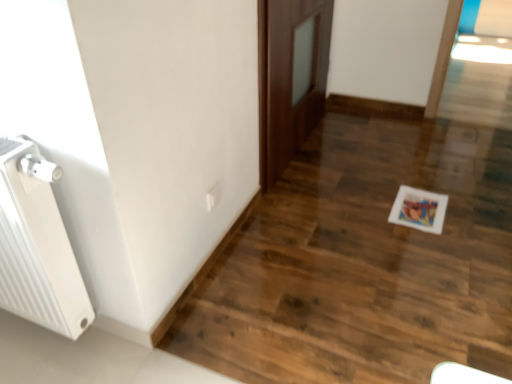
Locate an element on the screen. The height and width of the screenshot is (384, 512). white plastic electric outlet at lower center is located at coordinates (213, 196).

Where is `white plastic electric outlet at lower center`? white plastic electric outlet at lower center is located at coordinates (213, 196).

Considering the sizes of white ribbed radiator at left and brown wooden door at center in the image, is white ribbed radiator at left bigger or smaller than brown wooden door at center?

white ribbed radiator at left is smaller than brown wooden door at center.

Is white ribbed radiator at left inside the boundaries of brown wooden door at center, or outside?

white ribbed radiator at left cannot be found inside brown wooden door at center.

Does point (5, 168) appear closer or farther from the camera than point (308, 51)?

Point (5, 168) is positioned closer to the camera compared to point (308, 51).

How different are the orientations of white ribbed radiator at left and brown wooden door at center in degrees?

The angular difference between white ribbed radiator at left and brown wooden door at center is 89.5 degrees.

Is brown wooden door at center far away from white plastic electric outlet at lower center?

No, brown wooden door at center is not far away from white plastic electric outlet at lower center.

Does brown wooden door at center appear on the right side of white plastic electric outlet at lower center?

Indeed, brown wooden door at center is positioned on the right side of white plastic electric outlet at lower center.

How many degrees apart are the facing directions of brown wooden door at center and white plastic electric outlet at lower center?

0.0669 degrees separate the facing orientations of brown wooden door at center and white plastic electric outlet at lower center.

From the image's perspective, relative to white plastic electric outlet at lower center, is brown wooden door at center above or below?

Based on their image positions, brown wooden door at center is located above white plastic electric outlet at lower center.

Considering the positions of objects white plastic electric outlet at lower center and brown wooden door at center in the image provided, who is in front, white plastic electric outlet at lower center or brown wooden door at center?

white plastic electric outlet at lower center is more forward.

From a real-world perspective, which is physically below, white plastic electric outlet at lower center or brown wooden door at center?

white plastic electric outlet at lower center is physically lower.

Considering the sizes of objects white plastic electric outlet at lower center and brown wooden door at center in the image provided, who is thinner, white plastic electric outlet at lower center or brown wooden door at center?

With smaller width is white plastic electric outlet at lower center.

In the image, is brown wooden door at center positioned in front of or behind white ribbed radiator at left?

Clearly, brown wooden door at center is behind white ribbed radiator at left.

Which of these two, brown wooden door at center or white ribbed radiator at left, is smaller?

With smaller size is white ribbed radiator at left.

Can you confirm if brown wooden door at center is shorter than white ribbed radiator at left?

No, brown wooden door at center is not shorter than white ribbed radiator at left.

Is white plastic electric outlet at lower center positioned far away from white ribbed radiator at left?

They are positioned close to each other.

The height and width of the screenshot is (384, 512). Identify the location of radiator on the left of white plastic electric outlet at lower center. (37, 244).

Is white plastic electric outlet at lower center oriented away from white ribbed radiator at left?

No, white plastic electric outlet at lower center's orientation is not away from white ribbed radiator at left.

Is white ribbed radiator at left looking in the opposite direction of white plastic electric outlet at lower center?

Yes, white ribbed radiator at left is positioned with its back facing white plastic electric outlet at lower center.

Considering their positions, is white ribbed radiator at left located in front of or behind white plastic electric outlet at lower center?

In the image, white ribbed radiator at left appears in front of white plastic electric outlet at lower center.

Considering the sizes of objects white ribbed radiator at left and white plastic electric outlet at lower center in the image provided, who is bigger, white ribbed radiator at left or white plastic electric outlet at lower center?

With larger size is white ribbed radiator at left.

Locate an element on the screen. This screenshot has height=384, width=512. radiator lying below the brown wooden door at center (from the image's perspective) is located at coordinates (37, 244).

Identify the location of door that is above the white plastic electric outlet at lower center (from the image's perspective). Image resolution: width=512 pixels, height=384 pixels. (290, 77).

Which object lies further to the anchor point white ribbed radiator at left, white plastic electric outlet at lower center or brown wooden door at center?

The object further to white ribbed radiator at left is brown wooden door at center.

From the image, which object appears to be farther from white plastic electric outlet at lower center, brown wooden door at center or white ribbed radiator at left?

brown wooden door at center lies further to white plastic electric outlet at lower center than the other object.

Considering their positions, is brown wooden door at center positioned closer to white ribbed radiator at left than white plastic electric outlet at lower center?

white plastic electric outlet at lower center.

Looking at the image, which one is located further to brown wooden door at center, white plastic electric outlet at lower center or white ribbed radiator at left?

white ribbed radiator at left lies further to brown wooden door at center than the other object.

Which object lies further to the anchor point white plastic electric outlet at lower center, white ribbed radiator at left or brown wooden door at center?

brown wooden door at center is positioned further to the anchor white plastic electric outlet at lower center.

Considering their positions, is white ribbed radiator at left positioned further to brown wooden door at center than white plastic electric outlet at lower center?

The object further to brown wooden door at center is white ribbed radiator at left.

You are a GUI agent. You are given a task and a screenshot of the screen. Output one action in this format:
    pyautogui.click(x=<x>, y=<y>)
    Task: Click on the electric outlet between white ribbed radiator at left and brown wooden door at center from left to right
    This screenshot has height=384, width=512.
    Given the screenshot: What is the action you would take?
    pyautogui.click(x=213, y=196)